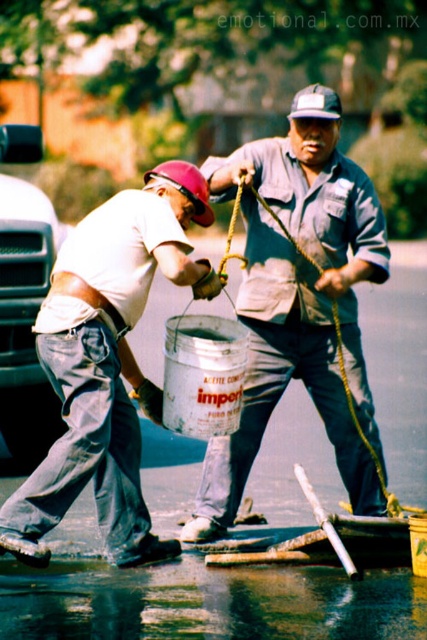
Question: Is matte white shirt at left thinner than wet asphalt at lower center?

Choices:
 (A) yes
 (B) no

Answer: (A)

Question: Is matte gray shirt at center smaller than wet asphalt at lower center?

Choices:
 (A) yes
 (B) no

Answer: (B)

Question: Which of the following is the closest to the observer?

Choices:
 (A) (306, 353)
 (B) (116, 467)

Answer: (B)

Question: Which point appears closest to the camera in this image?

Choices:
 (A) (63, 368)
 (B) (225, 627)

Answer: (B)

Question: Does matte gray shirt at center come in front of wet asphalt at lower center?

Choices:
 (A) yes
 (B) no

Answer: (B)

Question: Which point is farther from the camera taking this photo?

Choices:
 (A) pyautogui.click(x=46, y=627)
 (B) pyautogui.click(x=181, y=173)
 (C) pyautogui.click(x=242, y=166)

Answer: (C)